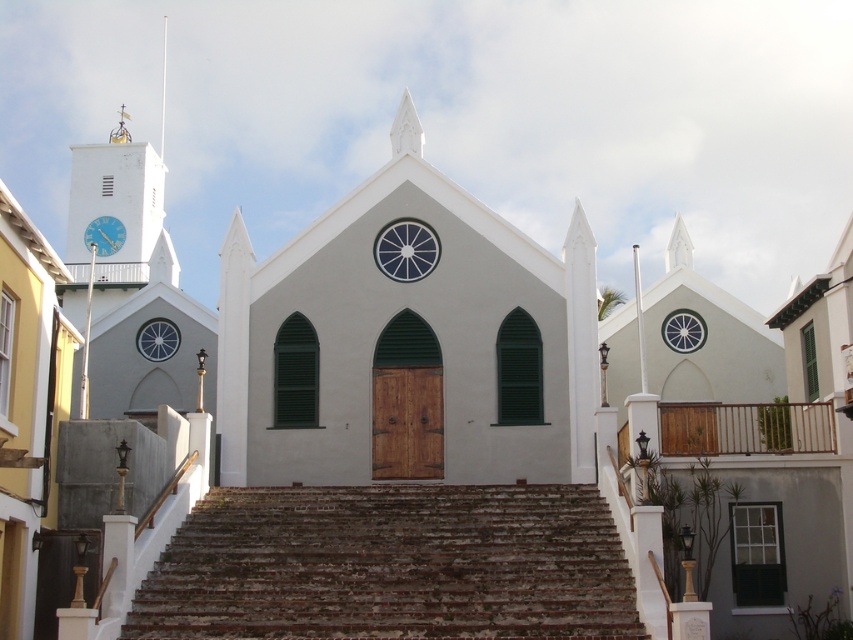
You are standing at the entrance of the church and see two points marked in the image. Which point is closer to you, point (x=383, y=252) or point (x=161, y=326)?

Point (x=383, y=252) is in front of point (x=161, y=326), so it is closer to you.

Based on the scene description, what object is located at the coordinates point (157,339)?

The point (157,339) marks the location of the matte glass clock at left.

You are standing in front of the church and notice two clocks. The first is the matte blue glass clock at center and the second is the matte glass clock at left. Which clock is positioned to the right of the other?

The matte blue glass clock at center is positioned to the right of the matte glass clock at left.